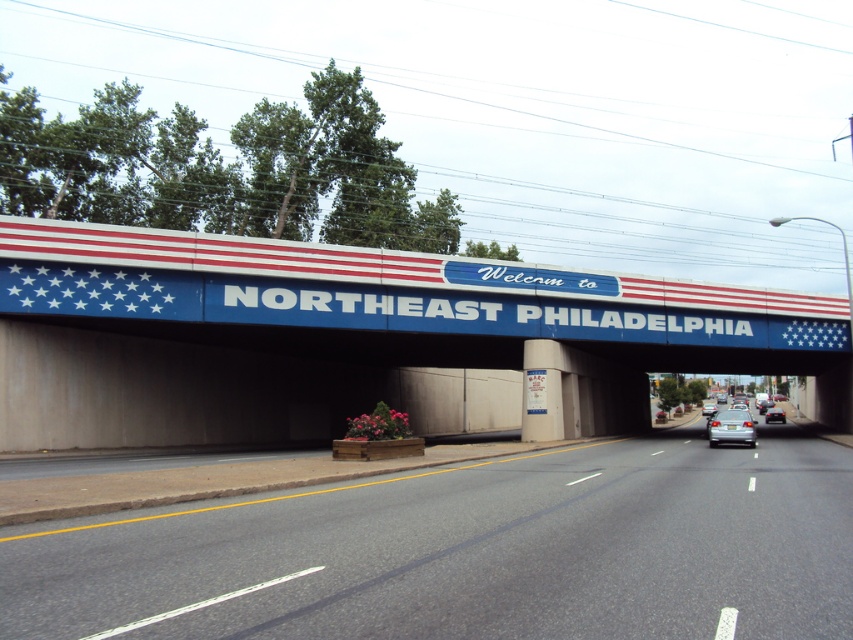
Question: Is asphalt road at center thinner than silver metallic sedan at center?

Choices:
 (A) yes
 (B) no

Answer: (B)

Question: Which object appears farthest from the camera in this image?

Choices:
 (A) metallic silver sedan at center
 (B) silver metallic sedan at center

Answer: (B)

Question: Which of the following is the farthest from the observer?

Choices:
 (A) (715, 410)
 (B) (779, 419)
 (C) (543, 332)
 (D) (730, 422)

Answer: (A)

Question: Which of the following is the farthest from the observer?

Choices:
 (A) (709, 410)
 (B) (730, 410)
 (C) (445, 506)

Answer: (A)

Question: Can you confirm if metallic silver sedan at center is positioned to the right of silver metallic sedan at center?

Choices:
 (A) yes
 (B) no

Answer: (B)

Question: Observing the image, what is the correct spatial positioning of asphalt road at center in reference to blue painted concrete bridge at upper center?

Choices:
 (A) right
 (B) left

Answer: (B)